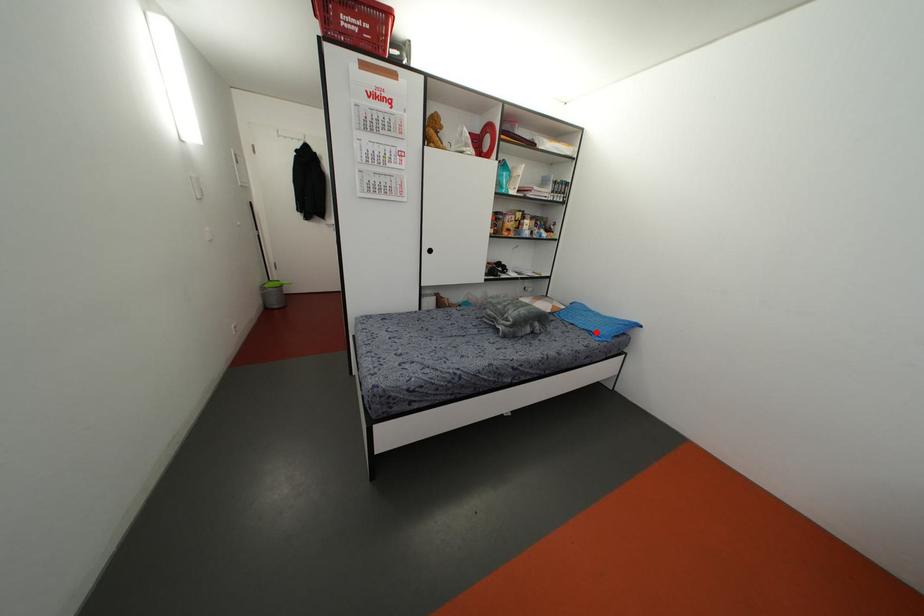
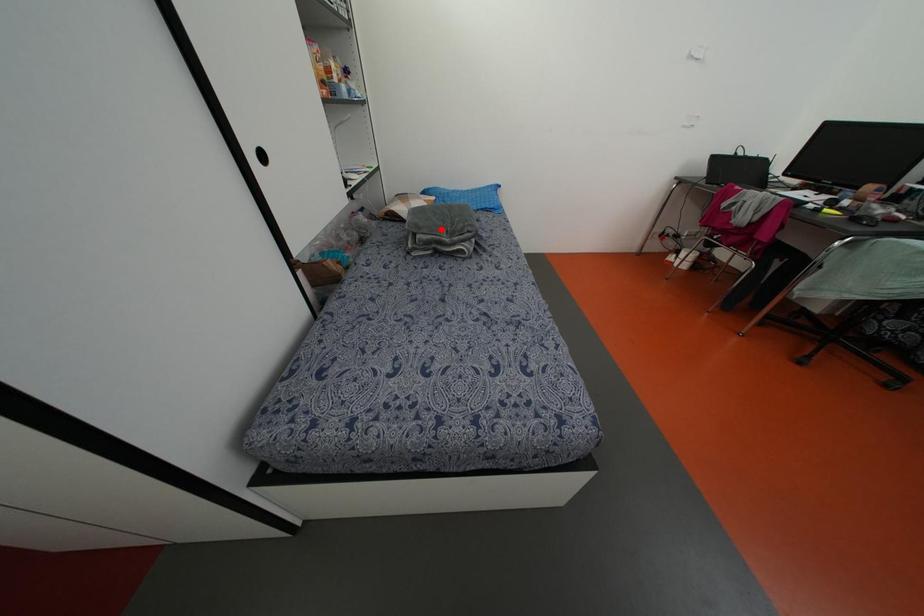
I am providing you with two images of the same scene from different viewpoints. A red point is marked on the first image and another point is marked on the second image. Do the highlighted points in image1 and image2 indicate the same real-world spot?

No